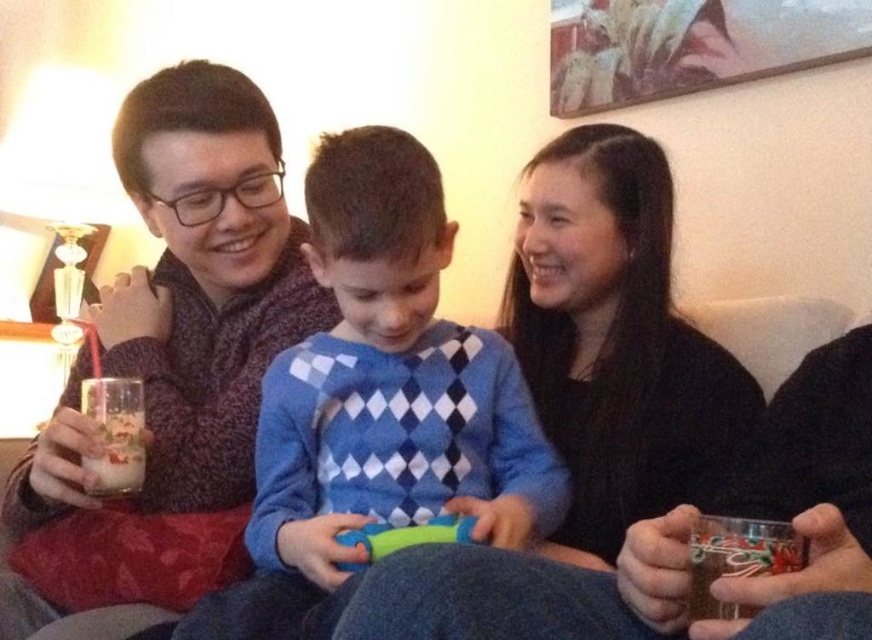
What object is located at the coordinates point (x=615, y=340)?

The point (x=615, y=340) corresponds to the black matte sweater at upper center.

You are a photographer trying to capture a candid shot of the black matte sweater at upper center and the green rubber toy at center. To ensure both are in frame, you need to know their relative positions. Which object is positioned to the right of the other?

The black matte sweater at upper center is to the right of the green rubber toy at center.

You are a photographer trying to capture the child wearing the blue diamond patterned sweater at center in the image. The photographer is positioned at point A. The photographer wants to ensure that the child is centered in the photo. Where should the photographer move to? Please answer with coordinates in the format of a point like point A is at coordinate point (379, 401). The photographer is currently at point A. The photographer wants to move to a new point so that the child wearing the blue diamond p

The photographer should move to point A at coordinate (379, 401) to center the child wearing the blue diamond patterned sweater at center in the photo.